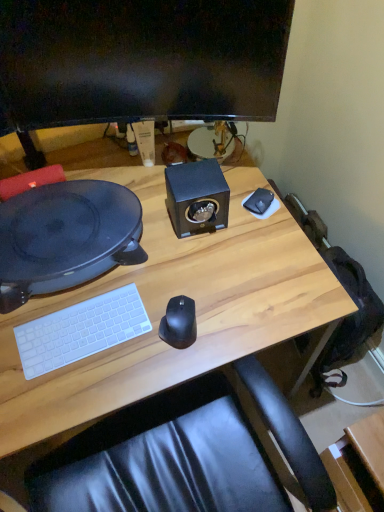
The width and height of the screenshot is (384, 512). In order to click on empty space that is in between black matte speaker at center and white matte mousepad at upper right in this screenshot , I will do `click(237, 206)`.